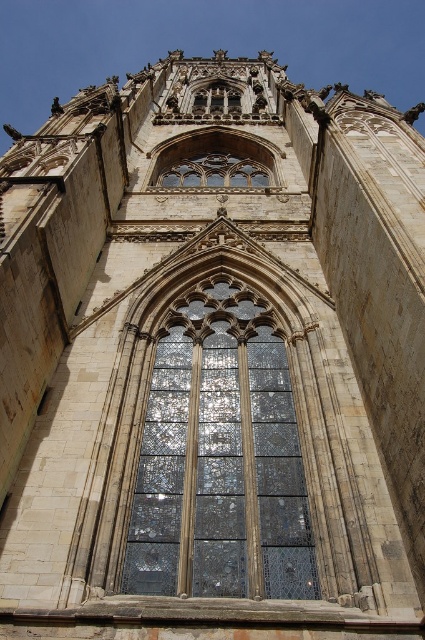
You are standing inside the cathedral and want to take a photo of the stained glass window. The camera you are using has a focal length of 50mm. If the point at coordinates point (x=246, y=404) is 64.09 meters away from the camera, will this point appear in the center of the photo?

The point at coordinates point (x=246, y=404) is 64.09 meters away from the camera. Since the camera is focused on the stained glass window, which is the focal point, the point at coordinates point (x=246, y=404) would likely be within the frame and appear in the photo, but its exact position depends on the camera angle and composition. However, given the distance, it might not be centered unless specifically aimed.

In the scene shown: You are standing in front of the cathedral and want to take a photo of the stained glass window at center. To ensure the window is centered in your shot, where should you aim your camera? Please provide coordinates based on the image frame where the bottom left corner is the origin point.

The stained glass window at center is located at coordinates 0.722 on the x axis and 0.520 on the y axis. So you should aim your camera at the point (221, 461) to center it in the shot.

You are an architect planning to install a new support beam between the stained glass window at center and the stained glass window at upper center. The beam requires a minimum of 50 meters of space between them to be installed safely. Can the beam be installed between the two stained glass windows?

The stained glass window at center is 57.80 meters from the stained glass window at upper center, which exceeds the minimum required 50 meters. Therefore, the support beam can be safely installed between the two stained glass windows.